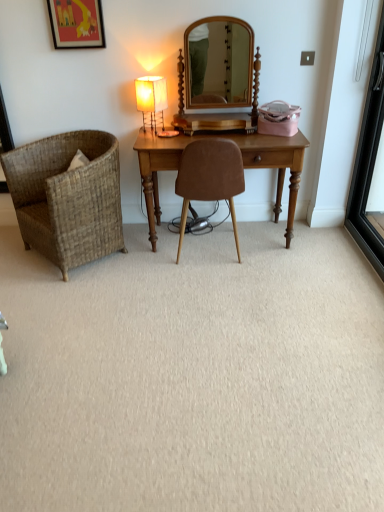
Image resolution: width=384 pixels, height=512 pixels. Identify the location of woven brown chair at left, arranged as the second chair when viewed from the right. (67, 197).

Describe the element at coordinates (151, 99) in the screenshot. I see `matte fabric table lamp at center` at that location.

Find the location of a particular element. matte black picture frame at upper left is located at coordinates point(76,24).

What do you see at coordinates (210, 178) in the screenshot? I see `brown suede chair at center, marked as the first chair in a right-to-left arrangement` at bounding box center [210, 178].

What are the coordinates of `wooden desk at center` in the screenshot? It's located at (243, 166).

From a real-world perspective, between black glass screen door at right and matte fabric table lamp at center, who is vertically higher?

From a 3D spatial view, matte fabric table lamp at center is above.

How different are the orientations of black glass screen door at right and matte fabric table lamp at center in degrees?

They differ by 149 degrees in their facing directions.

Which object is positioned more to the left, black glass screen door at right or matte fabric table lamp at center?

Positioned to the left is matte fabric table lamp at center.

Identify the location of the 1st chair below when counting from the black glass screen door at right (from the image's perspective). This screenshot has width=384, height=512. (x=210, y=178).

Consider the image. Which of these two, brown suede chair at center, which is counted as the 2th chair, starting from the left, or black glass screen door at right, is bigger?

With larger size is brown suede chair at center, which is counted as the 2th chair, starting from the left.

Is brown suede chair at center, which is counted as the 2th chair, starting from the left, in contact with black glass screen door at right?

No, brown suede chair at center, which is counted as the 2th chair, starting from the left, is not next to black glass screen door at right.

In the scene shown: From a real-world perspective, is brown suede chair at center, marked as the first chair in a right-to-left arrangement, above or below black glass screen door at right?

brown suede chair at center, marked as the first chair in a right-to-left arrangement, is situated lower than black glass screen door at right in the real world.

Is wooden desk at center completely or partially outside of matte black picture frame at upper left?

Absolutely, wooden desk at center is external to matte black picture frame at upper left.

Considering the positions of point (289, 228) and point (56, 13), is point (289, 228) closer or farther from the camera than point (56, 13)?

Clearly, point (289, 228) is more distant from the camera than point (56, 13).

Which object is positioned more to the left, wooden desk at center or matte black picture frame at upper left?

matte black picture frame at upper left is more to the left.

Is wooden desk at center touching matte black picture frame at upper left?

There is a gap between wooden desk at center and matte black picture frame at upper left.

The height and width of the screenshot is (512, 384). Find the location of `picture frame on the left of black glass screen door at right`. picture frame on the left of black glass screen door at right is located at coordinates click(76, 24).

Looking at this image, is black glass screen door at right directly adjacent to matte black picture frame at upper left?

They are not placed beside each other.

Does point (382, 65) appear closer or farther from the camera than point (90, 8)?

Point (382, 65) is positioned farther from the camera compared to point (90, 8).

How different are the orientations of black glass screen door at right and matte black picture frame at upper left in degrees?

89.5 degrees.

Is wooden desk at center with matte fabric table lamp at center?

No, wooden desk at center is not with matte fabric table lamp at center.

Which of these two, wooden desk at center or matte fabric table lamp at center, is thinner?

Thinner between the two is matte fabric table lamp at center.

From a real-world perspective, does wooden desk at center stand above matte fabric table lamp at center?

No, from a real-world perspective, wooden desk at center is not above matte fabric table lamp at center.

From the image's perspective, does wooden desk at center appear lower than matte fabric table lamp at center?

Indeed, from the image's perspective, wooden desk at center is shown beneath matte fabric table lamp at center.

Is black glass screen door at right completely or partially inside matte fabric table lamp at center?

No, black glass screen door at right is not a part of matte fabric table lamp at center.

Which object is positioned more to the left, matte fabric table lamp at center or black glass screen door at right?

matte fabric table lamp at center.

Measure the distance between matte fabric table lamp at center and black glass screen door at right.

They are 4.66 feet apart.

The height and width of the screenshot is (512, 384). In order to click on screen door below the matte fabric table lamp at center (from the image's perspective) in this screenshot , I will do `click(368, 163)`.

Which object is thinner, black glass screen door at right or brown suede chair at center, marked as the first chair in a right-to-left arrangement?

With smaller width is black glass screen door at right.

In the scene shown: From the image's perspective, which one is positioned higher, black glass screen door at right or brown suede chair at center, which is counted as the 2th chair, starting from the left?

black glass screen door at right, from the image's perspective.

Is black glass screen door at right far from brown suede chair at center, which is counted as the 2th chair, starting from the left?

Yes, black glass screen door at right and brown suede chair at center, which is counted as the 2th chair, starting from the left, are quite far apart.

Can you confirm if black glass screen door at right is taller than brown suede chair at center, which is counted as the 2th chair, starting from the left?

Correct, black glass screen door at right is much taller as brown suede chair at center, which is counted as the 2th chair, starting from the left.

Locate an element on the screen. screen door that appears below the matte fabric table lamp at center (from a real-world perspective) is located at coordinates (368, 163).

Image resolution: width=384 pixels, height=512 pixels. What are the coordinates of `chair that is the 1st one when counting leftward from the black glass screen door at right` in the screenshot? It's located at (210, 178).

Considering their positions, is wooden desk at center positioned further to matte fabric table lamp at center than woven brown chair at left, arranged as the second chair when viewed from the right?

Based on the image, woven brown chair at left, arranged as the second chair when viewed from the right, appears to be further to matte fabric table lamp at center.

Estimate the real-world distances between objects in this image. Which object is further from brown suede chair at center, marked as the first chair in a right-to-left arrangement, matte fabric table lamp at center or woven brown chair at left, arranged as the second chair when viewed from the right?

Among the two, woven brown chair at left, arranged as the second chair when viewed from the right, is located further to brown suede chair at center, marked as the first chair in a right-to-left arrangement.

From the image, which object appears to be farther from wooden desk at center, brown suede chair at center, marked as the first chair in a right-to-left arrangement, or black glass screen door at right?

Based on the image, black glass screen door at right appears to be further to wooden desk at center.

When comparing their distances from matte black picture frame at upper left, does woven brown chair at left, marked as the 1th chair in a left-to-right arrangement, or matte fabric table lamp at center seem closer?

Among the two, matte fabric table lamp at center is located nearer to matte black picture frame at upper left.

Estimate the real-world distances between objects in this image. Which object is further from wooden desk at center, matte fabric table lamp at center or black glass screen door at right?

black glass screen door at right is positioned further to the anchor wooden desk at center.

Based on their spatial positions, is matte black picture frame at upper left or wooden desk at center closer to woven brown chair at left, marked as the 1th chair in a left-to-right arrangement?

wooden desk at center is closer to woven brown chair at left, marked as the 1th chair in a left-to-right arrangement.

Estimate the real-world distances between objects in this image. Which object is further from matte black picture frame at upper left, brown suede chair at center, which is counted as the 2th chair, starting from the left, or black glass screen door at right?

black glass screen door at right is positioned further to the anchor matte black picture frame at upper left.

Based on their spatial positions, is matte black picture frame at upper left or matte fabric table lamp at center further from wooden desk at center?

Based on the image, matte black picture frame at upper left appears to be further to wooden desk at center.

Locate an element on the screen. The image size is (384, 512). table between matte black picture frame at upper left and brown suede chair at center, marked as the first chair in a right-to-left arrangement, from top to bottom is located at coordinates (243, 166).

Where is `table between matte fabric table lamp at center and brown suede chair at center, which is counted as the 2th chair, starting from the left, in the vertical direction`? The width and height of the screenshot is (384, 512). table between matte fabric table lamp at center and brown suede chair at center, which is counted as the 2th chair, starting from the left, in the vertical direction is located at coordinates (243, 166).

At what (x,y) coordinates should I click in order to perform the action: click on table between matte fabric table lamp at center and black glass screen door at right in the horizontal direction. Please return your answer as a coordinate pair (x, y). This screenshot has height=512, width=384. Looking at the image, I should click on (243, 166).

The width and height of the screenshot is (384, 512). What are the coordinates of `chair that lies between matte black picture frame at upper left and woven brown chair at left, marked as the 1th chair in a left-to-right arrangement, from top to bottom` in the screenshot? It's located at (210, 178).